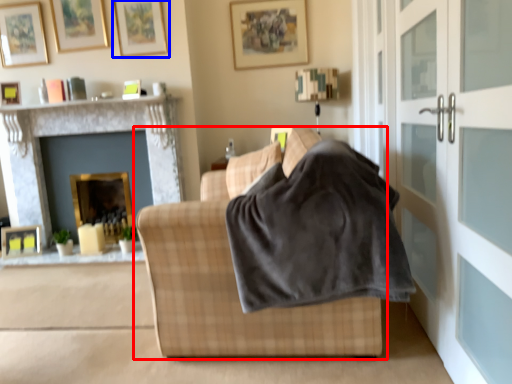
Question: Among these objects, which one is farthest to the camera, studio couch (highlighted by a red box) or picture frame (highlighted by a blue box)?

Choices:
 (A) studio couch
 (B) picture frame

Answer: (B)